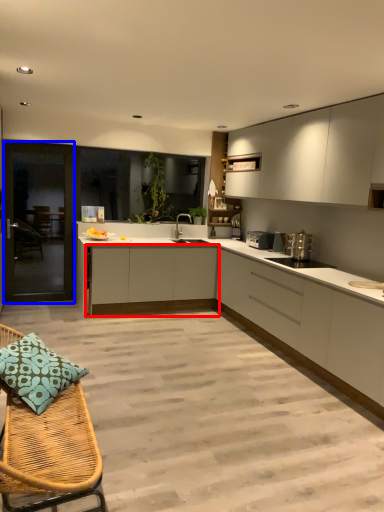
Question: Which point is further to the camera, cabinetry (highlighted by a red box) or screen door (highlighted by a blue box)?

Choices:
 (A) cabinetry
 (B) screen door

Answer: (B)